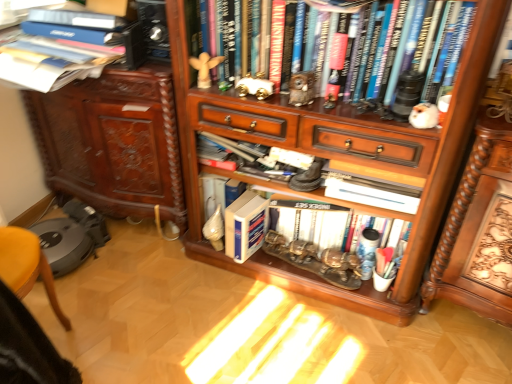
Question: Which direction should I rotate to face white matte book at center, which is the second book in bottom-to-top order, — up or down?

Choices:
 (A) up
 (B) down

Answer: (B)

Question: Does wooden carved desk at lower right have a lesser height compared to blue hardcover book at center, the fourth book from the top?

Choices:
 (A) yes
 (B) no

Answer: (B)

Question: Is wooden carved desk at lower right completely or partially outside of blue hardcover book at center, the 1th book from the bottom?

Choices:
 (A) no
 (B) yes

Answer: (B)

Question: Can you confirm if wooden carved desk at lower right is taller than blue hardcover book at center, the 1th book from the bottom?

Choices:
 (A) no
 (B) yes

Answer: (B)

Question: From a real-world perspective, is wooden carved desk at lower right located higher than blue hardcover book at center, the fourth book from the top?

Choices:
 (A) no
 (B) yes

Answer: (B)

Question: From the image's perspective, is wooden carved desk at lower right under blue hardcover book at center, the fourth book from the top?

Choices:
 (A) no
 (B) yes

Answer: (A)

Question: Considering the relative positions of wooden carved desk at lower right and blue hardcover book at center, the fourth book from the top, in the image provided, is wooden carved desk at lower right in front of blue hardcover book at center, the fourth book from the top,?

Choices:
 (A) yes
 (B) no

Answer: (A)

Question: Is wooden cabinet at left behind wooden carved desk at lower right?

Choices:
 (A) no
 (B) yes

Answer: (B)

Question: Does wooden cabinet at left lie in front of wooden carved desk at lower right?

Choices:
 (A) yes
 (B) no

Answer: (B)

Question: Is wooden cabinet at left to the left of wooden carved desk at lower right from the viewer's perspective?

Choices:
 (A) yes
 (B) no

Answer: (A)

Question: Is wooden cabinet at left positioned far away from wooden carved desk at lower right?

Choices:
 (A) no
 (B) yes

Answer: (B)

Question: Considering the relative sizes of wooden cabinet at left and wooden carved desk at lower right in the image provided, is wooden cabinet at left taller than wooden carved desk at lower right?

Choices:
 (A) yes
 (B) no

Answer: (A)

Question: Is wooden cabinet at left aimed at wooden carved desk at lower right?

Choices:
 (A) no
 (B) yes

Answer: (A)

Question: Considering the relative sizes of hardcover book at upper left, placed as the fourth book when sorted from bottom to top, and wooden carved desk at lower right in the image provided, is hardcover book at upper left, placed as the fourth book when sorted from bottom to top, wider than wooden carved desk at lower right?

Choices:
 (A) yes
 (B) no

Answer: (B)